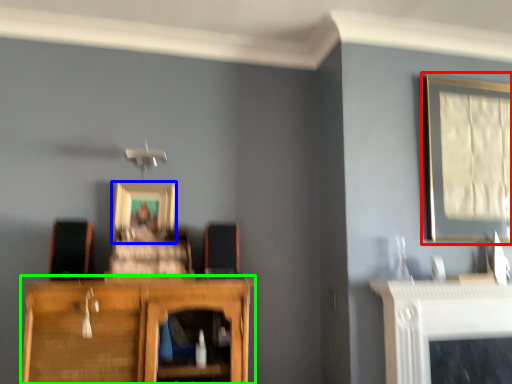
Question: Which is farther away from picture frame (highlighted by a red box)? picture frame (highlighted by a blue box) or cupboard (highlighted by a green box)?

Choices:
 (A) picture frame
 (B) cupboard

Answer: (A)